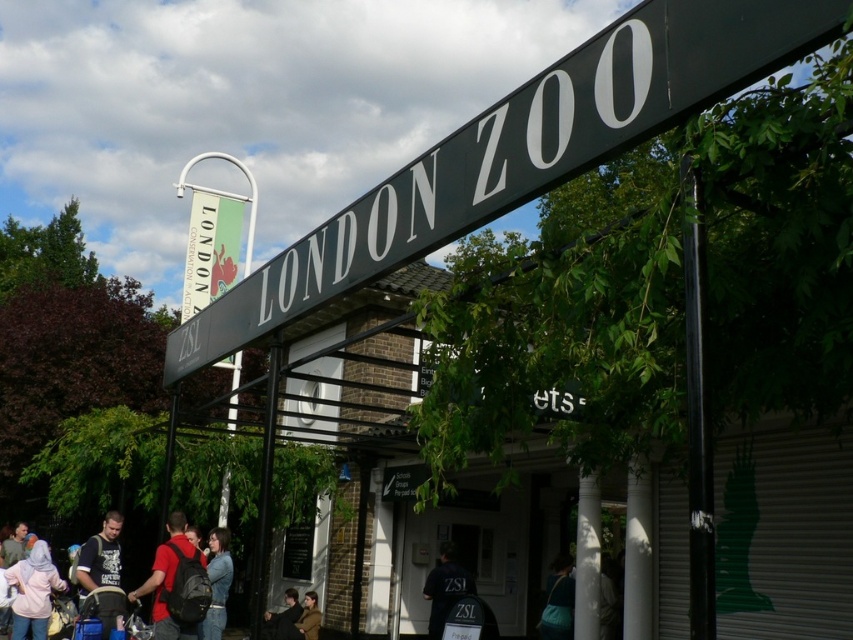
Question: Does matte red backpack at lower left appear over white glossy pillar at center?

Choices:
 (A) no
 (B) yes

Answer: (A)

Question: Estimate the real-world distances between objects in this image. Which object is closer to the pale pink fabric hijab at lower left?

Choices:
 (A) black metal pole at right
 (B) green fabric banner at upper left

Answer: (B)

Question: Estimate the real-world distances between objects in this image. Which object is farther from the black metal pole at right?

Choices:
 (A) pale pink fabric hijab at lower left
 (B) matte black backpack at lower left
 (C) dark brown leather jacket at lower center
 (D) brown leather jacket at lower center

Answer: (C)

Question: Which object is positioned farthest from the black metal pole at right?

Choices:
 (A) pale pink fabric hijab at lower left
 (B) denim jacket at lower center
 (C) dark brown leather jacket at lower center
 (D) dark blue fabric jacket at lower right

Answer: (C)

Question: Can you confirm if matte black backpack at lower left is positioned to the right of dark brown leather jacket at lower center?

Choices:
 (A) yes
 (B) no

Answer: (B)

Question: Is dark blue fabric jacket at lower right below denim jacket at lower center?

Choices:
 (A) yes
 (B) no

Answer: (A)